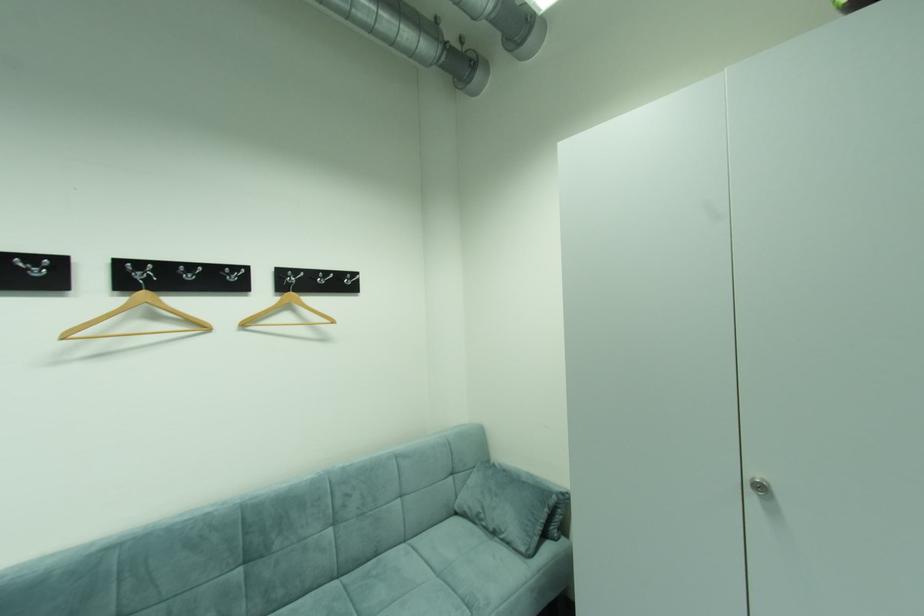
Identify the location of grey sofa pillow. (505, 506).